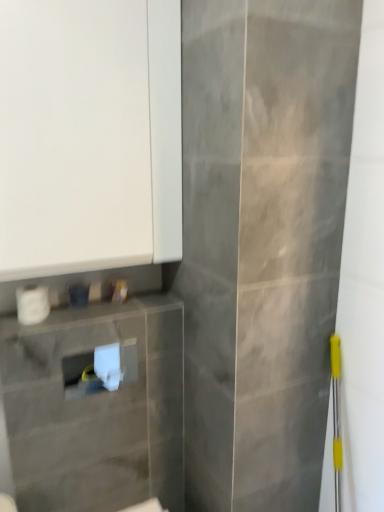
You are a GUI agent. You are given a task and a screenshot of the screen. Output one action in this format:
    pyautogui.click(x=<x>, y=<y>)
    Task: Click on the white matte cabinet at upper left
    The image size is (384, 512).
    Given the screenshot: What is the action you would take?
    pyautogui.click(x=89, y=135)

The height and width of the screenshot is (512, 384). What do you see at coordinates (89, 135) in the screenshot? I see `white matte cabinet at upper left` at bounding box center [89, 135].

This screenshot has height=512, width=384. Find the location of `white matte toilet paper at lower left`. white matte toilet paper at lower left is located at coordinates (32, 304).

Measure the distance between point (38, 306) and camera.

Point (38, 306) is 1.29 meters away from camera.

What is the approximate width of white matte toilet paper at lower left?

white matte toilet paper at lower left is 3.71 inches wide.

Describe the element at coordinates (32, 304) in the screenshot. The height and width of the screenshot is (512, 384). I see `white matte toilet paper at lower left` at that location.

Where is `white matte cabinet at upper left`? white matte cabinet at upper left is located at coordinates (89, 135).

Which is more to the right, white matte toilet paper at lower left or white matte cabinet at upper left?

From the viewer's perspective, white matte cabinet at upper left appears more on the right side.

Based on the photo, is the position of white matte toilet paper at lower left less distant than that of white matte cabinet at upper left?

No, it is behind white matte cabinet at upper left.

Which is closer to the camera, [33,320] or [175,165]?

A: Point [33,320] is positioned closer to the camera compared to point [175,165].

From the image's perspective, is white matte toilet paper at lower left under white matte cabinet at upper left?

Yes, from the image's perspective, white matte toilet paper at lower left is beneath white matte cabinet at upper left.

From a real-world perspective, which is physically below, white matte toilet paper at lower left or white matte cabinet at upper left?

From a 3D spatial view, white matte toilet paper at lower left is below.

Between white matte toilet paper at lower left and white matte cabinet at upper left, which one has smaller width?

With smaller width is white matte toilet paper at lower left.

Does white matte toilet paper at lower left have a lesser height compared to white matte cabinet at upper left?

Indeed, white matte toilet paper at lower left has a lesser height compared to white matte cabinet at upper left.

Based on their sizes in the image, would you say white matte toilet paper at lower left is bigger or smaller than white matte cabinet at upper left?

Clearly, white matte toilet paper at lower left is smaller in size than white matte cabinet at upper left.

Does white matte toilet paper at lower left contain white matte cabinet at upper left?

No, white matte toilet paper at lower left does not contain white matte cabinet at upper left.

Is white matte toilet paper at lower left next to white matte cabinet at upper left?

white matte toilet paper at lower left is not next to white matte cabinet at upper left, and they're not touching.

Is white matte toilet paper at lower left oriented away from white matte cabinet at upper left?

No, white matte toilet paper at lower left's orientation is not away from white matte cabinet at upper left.

Measure the distance between white matte toilet paper at lower left and white matte cabinet at upper left.

19.02 inches.

Locate an element on the screen. This screenshot has width=384, height=512. toilet paper directly beneath the white matte cabinet at upper left (from a real-world perspective) is located at coordinates (32, 304).

Considering the relative positions of white matte cabinet at upper left and white matte toilet paper at lower left in the image provided, is white matte cabinet at upper left to the right of white matte toilet paper at lower left from the viewer's perspective?

Yes.

Considering their positions, is white matte cabinet at upper left located in front of or behind white matte toilet paper at lower left?

Clearly, white matte cabinet at upper left is in front of white matte toilet paper at lower left.

Which point is more forward, (167,138) or (21,303)?

The point (21,303) is closer to the camera.

From the image's perspective, is white matte cabinet at upper left positioned above or below white matte toilet paper at lower left?

From the image's perspective, white matte cabinet at upper left appears above white matte toilet paper at lower left.

From a real-world perspective, which is physically below, white matte cabinet at upper left or white matte toilet paper at lower left?

white matte toilet paper at lower left is physically lower.

Does white matte cabinet at upper left have a greater width compared to white matte toilet paper at lower left?

Yes, white matte cabinet at upper left is wider than white matte toilet paper at lower left.

From their relative heights in the image, would you say white matte cabinet at upper left is taller or shorter than white matte toilet paper at lower left?

white matte cabinet at upper left is taller than white matte toilet paper at lower left.

Based on their sizes in the image, would you say white matte cabinet at upper left is bigger or smaller than white matte toilet paper at lower left?

Clearly, white matte cabinet at upper left is larger in size than white matte toilet paper at lower left.

Is white matte toilet paper at lower left completely or partially inside white matte cabinet at upper left?

Definitely not — white matte toilet paper at lower left is not inside white matte cabinet at upper left.

Would you consider white matte cabinet at upper left to be distant from white matte toilet paper at lower left?

white matte cabinet at upper left is near white matte toilet paper at lower left, not far away.

Is white matte cabinet at upper left facing towards white matte toilet paper at lower left?

No, white matte cabinet at upper left is not aimed at white matte toilet paper at lower left.

Consider the image. How much distance is there between white matte cabinet at upper left and white matte toilet paper at lower left?

The distance of white matte cabinet at upper left from white matte toilet paper at lower left is 48.30 centimeters.

This screenshot has height=512, width=384. What are the coordinates of `cabinetry above the white matte toilet paper at lower left (from the image's perspective)` in the screenshot? It's located at (89, 135).

Identify the location of toilet paper located underneath the white matte cabinet at upper left (from a real-world perspective). Image resolution: width=384 pixels, height=512 pixels. (32, 304).

I want to click on cabinetry that appears above the white matte toilet paper at lower left (from the image's perspective), so click(x=89, y=135).